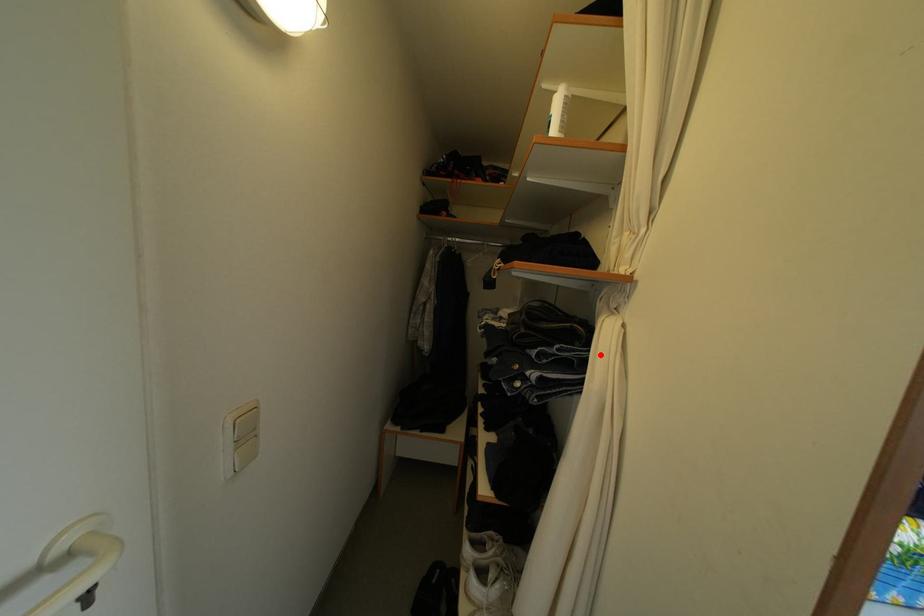
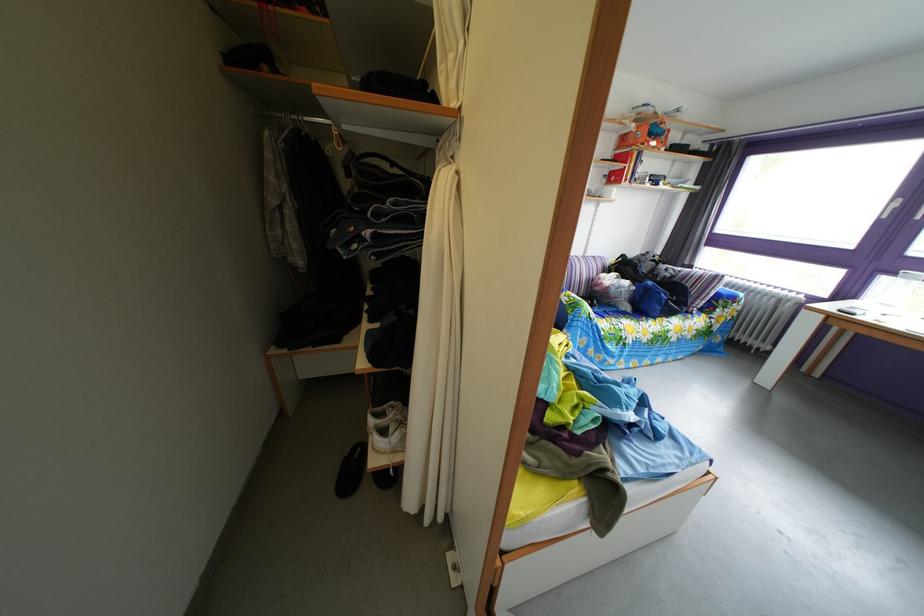
The point at the highlighted location is marked in the first image. Where is the corresponding point in the second image?

(438, 207)